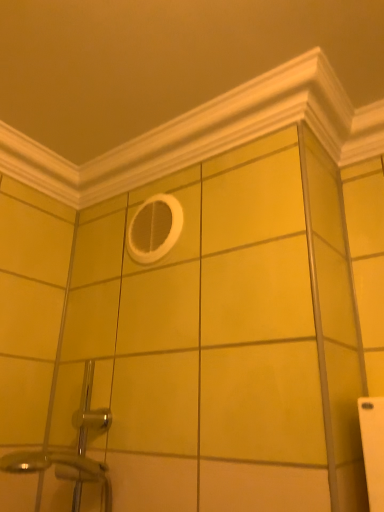
At what (x,y) coordinates should I click in order to perform the action: click on white matte mirror at upper center. Please return your answer as a coordinate pair (x, y). Looking at the image, I should click on (155, 228).

The image size is (384, 512). Describe the element at coordinates (155, 228) in the screenshot. I see `white matte mirror at upper center` at that location.

I want to click on white matte mirror at upper center, so click(x=155, y=228).